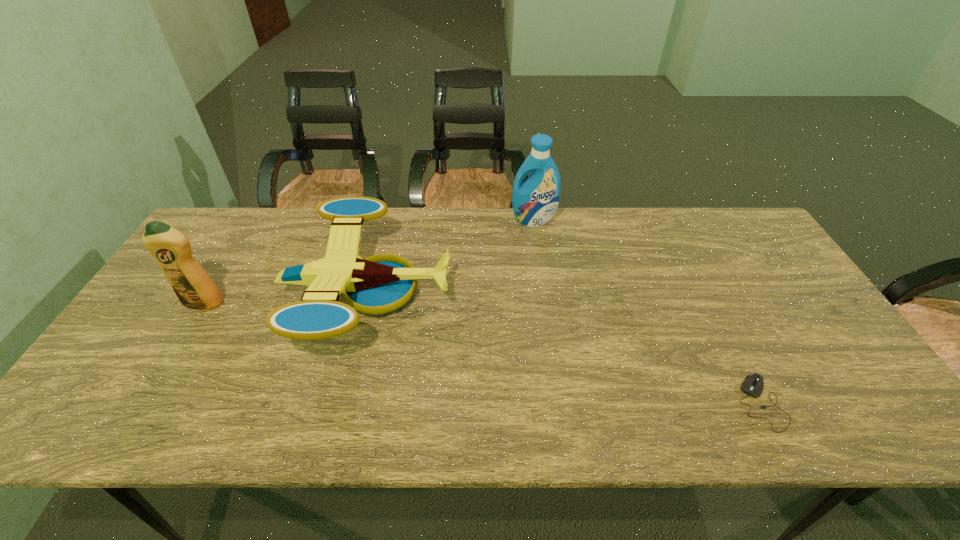
Find the location of a particular element. vacant position in the image that satisfies the following two spatial constraints: 1. on the front-facing side of the right detergent; 2. on the left side of the shortest object is located at coordinates (561, 402).